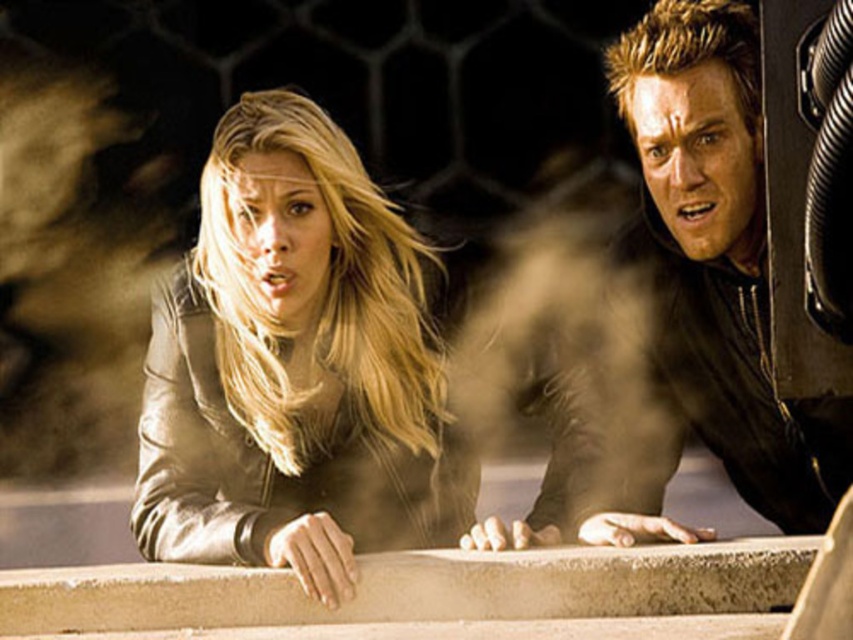
Does leather jacket at center have a greater height compared to matte black jacket at right?

Incorrect, leather jacket at center's height is not larger of matte black jacket at right's.

Is leather jacket at center wider than matte black jacket at right?

Correct, the width of leather jacket at center exceeds that of matte black jacket at right.

Which is behind, point (270, 179) or point (755, 444)?

The point (755, 444) is more distant.

The width and height of the screenshot is (853, 640). I want to click on leather jacket at center, so click(x=296, y=365).